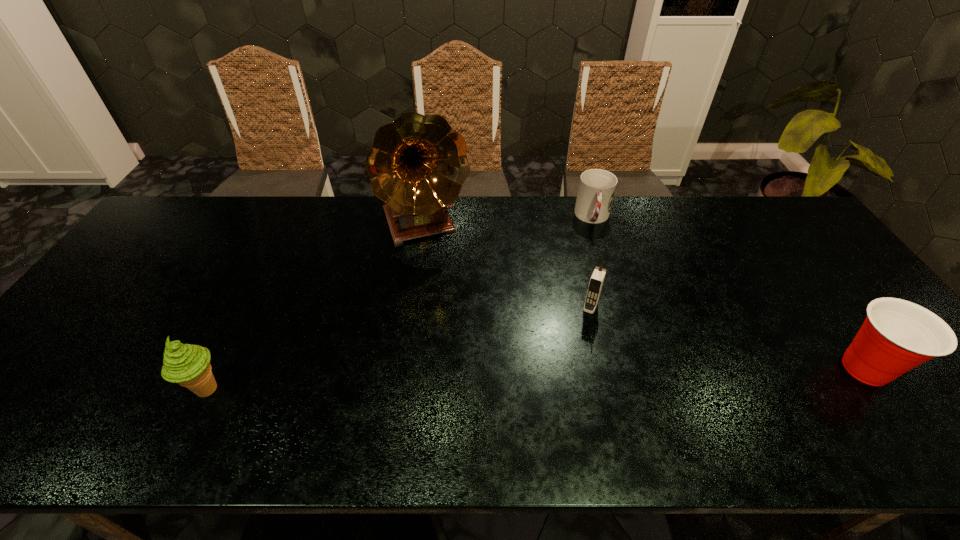
What are the coordinates of `icecream` in the screenshot? It's located at 188,365.

In order to click on the right cup in this screenshot , I will do `click(897, 335)`.

Identify the location of the rightmost object. (897, 335).

You are a GUI agent. You are given a task and a screenshot of the screen. Output one action in this format:
    pyautogui.click(x=<x>, y=<y>)
    Task: Click on the shorter cup
    The width and height of the screenshot is (960, 540).
    Given the screenshot: What is the action you would take?
    pyautogui.click(x=597, y=187)

Image resolution: width=960 pixels, height=540 pixels. Identify the location of the shortest object. (597, 187).

Find the location of `the third nearest object`. the third nearest object is located at coordinates (596, 282).

Find the location of `the second object from left to right`. the second object from left to right is located at coordinates (417, 165).

Find the location of a particular element. This screenshot has height=540, width=960. the tallest object is located at coordinates (417, 165).

Locate an element on the screen. The image size is (960, 540). vacant space positioned on the left of the icecream is located at coordinates (108, 390).

At what (x,y) coordinates should I click in order to perform the action: click on vacant space located on the left of the taller cup. Please return your answer as a coordinate pair (x, y). Looking at the image, I should click on (773, 369).